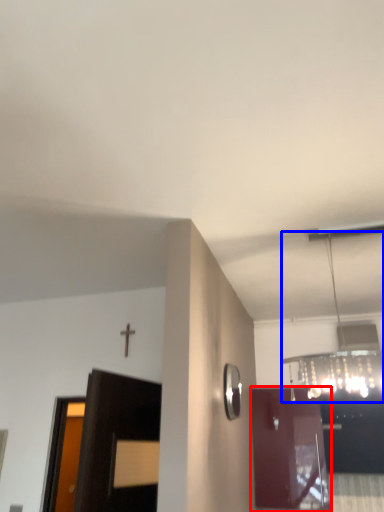
Question: Among these objects, which one is nearest to the camera, door (highlighted by a red box) or light fixture (highlighted by a blue box)?

Choices:
 (A) door
 (B) light fixture

Answer: (B)